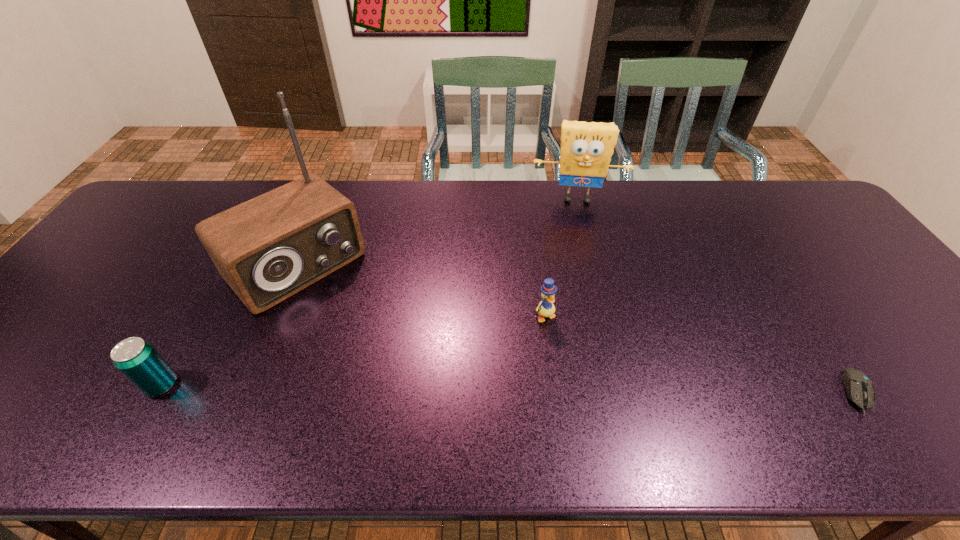
Where is `beer can present at the near edge`? beer can present at the near edge is located at coordinates (135, 358).

The image size is (960, 540). I want to click on computer mouse that is at the near edge, so click(859, 388).

This screenshot has width=960, height=540. Identify the location of vacant space at the far edge. (215, 213).

This screenshot has height=540, width=960. I want to click on blank space at the near edge, so click(845, 402).

Where is `vacant region at the left edge of the desktop`? vacant region at the left edge of the desktop is located at coordinates (108, 282).

Where is `vacant space at the right edge of the desktop`? This screenshot has height=540, width=960. vacant space at the right edge of the desktop is located at coordinates (852, 296).

Image resolution: width=960 pixels, height=540 pixels. Identify the location of free spot at the far left corner of the desktop. coord(171,184).

This screenshot has height=540, width=960. In the image, there is a desktop. Find the location of `free space at the far right corner`. free space at the far right corner is located at coordinates (784, 194).

Find the location of a particular element. This screenshot has width=960, height=540. vacant area that lies between the beer can and the duckling is located at coordinates (353, 350).

You are a GUI agent. You are given a task and a screenshot of the screen. Output one action in this format:
    pyautogui.click(x=<x>, y=<y>)
    Task: Click on the unoccupied position between the radio receiver and the duckling
    
    Given the screenshot: What is the action you would take?
    pyautogui.click(x=420, y=291)